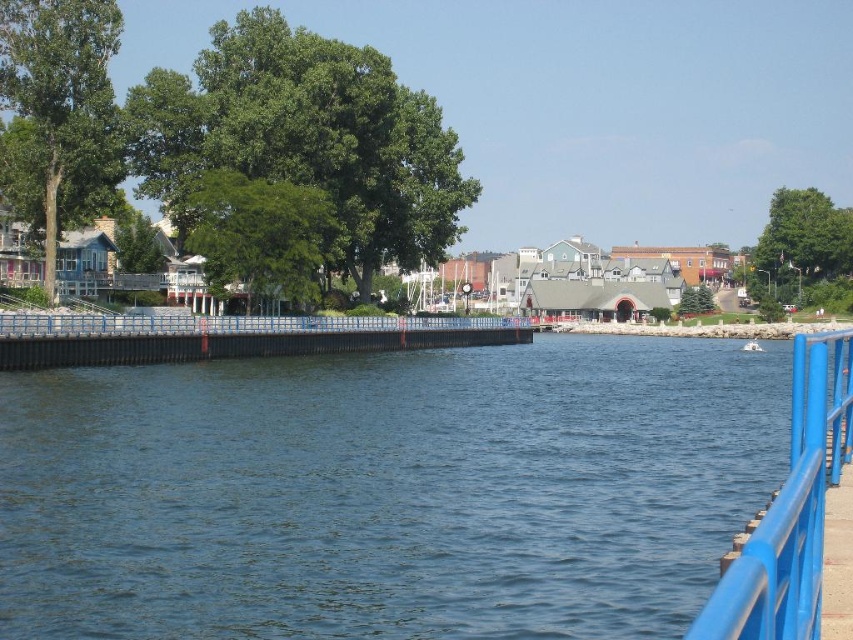
Question: Estimate the real-world distances between objects in this image. Which object is farther from the blue metallic river at center?

Choices:
 (A) blue metallic railing at right
 (B) white plastic boat at center

Answer: (B)

Question: Does blue metallic river at center come in front of white plastic boat at center?

Choices:
 (A) yes
 (B) no

Answer: (A)

Question: Which of the following is the farthest from the observer?

Choices:
 (A) white plastic boat at center
 (B) blue metallic river at center
 (C) blue metallic railing at right

Answer: (A)

Question: Is blue metallic river at center thinner than blue metallic railing at right?

Choices:
 (A) no
 (B) yes

Answer: (A)

Question: From the image, what is the correct spatial relationship of blue metallic railing at right in relation to white plastic boat at center?

Choices:
 (A) above
 (B) below

Answer: (B)

Question: Which is farther from the white plastic boat at center?

Choices:
 (A) blue metallic river at center
 (B) blue metallic railing at right

Answer: (B)